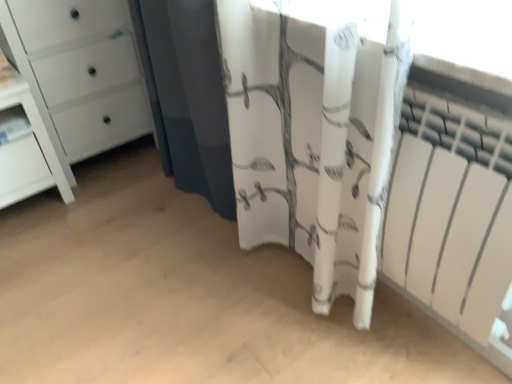
Question: Considering their positions, is white glossy bookshelf at left located in front of or behind white matte radiator at right?

Choices:
 (A) front
 (B) behind

Answer: (B)

Question: Looking at their shapes, would you say white glossy bookshelf at left is wider or thinner than white matte radiator at right?

Choices:
 (A) thin
 (B) wide

Answer: (B)

Question: Which object is the closest to the white fabric curtain at center?

Choices:
 (A) white glossy chest of drawers at left
 (B) white floral fabric at center
 (C) white glossy bookshelf at left
 (D) white matte radiator at right

Answer: (D)

Question: Estimate the real-world distances between objects in this image. Which object is farther from the white glossy chest of drawers at left?

Choices:
 (A) white matte radiator at right
 (B) white floral fabric at center
 (C) white fabric curtain at center
 (D) white glossy bookshelf at left

Answer: (A)